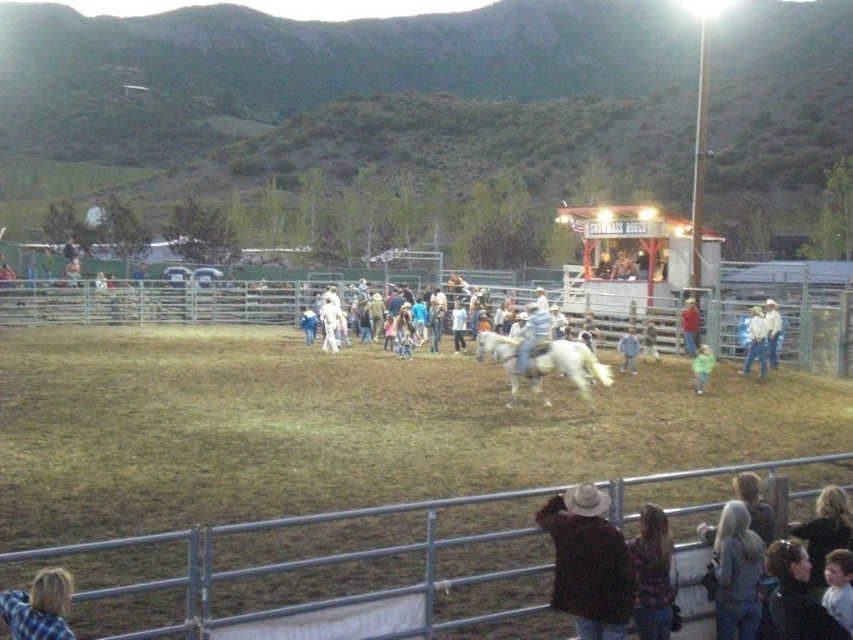
You are a photographer at the rodeo event. You want to capture a photo that includes both the metallic silver fence at lower center and the red cotton shirt at center. Considering their sizes, which object should you zoom in on to ensure both fit in the frame?

The metallic silver fence at lower center has a smaller width than the red cotton shirt at center. To ensure both fit in the frame, you should zoom out slightly to accommodate the larger red cotton shirt at center while still including the smaller metallic silver fence at lower center.

You are a photographer at the rodeo event. You want to capture a photo where both the smooth brown hair at upper center and the red cotton shirt at center are visible. Which object should you focus on first to ensure both are in frame?

You should focus on the red cotton shirt at center first because the smooth brown hair at upper center is shorter than the red cotton shirt at center, so by ensuring the shirt is in frame, the hair will also be visible.

You are a photographer positioned at the center of the rodeo arena. You want to take a photo that includes both the white horse being ridden and the Snowmass Rodeo structure. However, you notice two points in the scene at coordinates point (123, 308) and point (45, 632). Which of these points is closer to your camera position?

Point (45, 632) is closer to the camera because the description states that point (123, 308) is further away than point (45, 632).